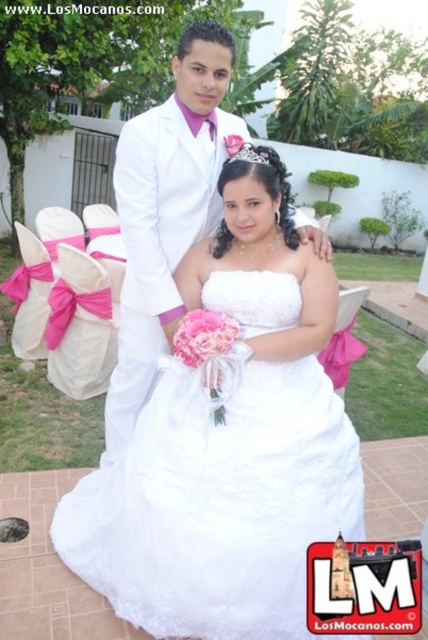
Question: Does white satin dress at center lie behind matte white suit at center?

Choices:
 (A) yes
 (B) no

Answer: (B)

Question: Which of the following is the closest to the observer?

Choices:
 (A) white satin dress at center
 (B) matte white suit at center

Answer: (A)

Question: Where is white satin dress at center located in relation to matte white suit at center in the image?

Choices:
 (A) right
 (B) left

Answer: (A)

Question: Which of the following is the farthest from the observer?

Choices:
 (A) matte white suit at center
 (B) white satin dress at center

Answer: (A)

Question: Does white satin dress at center appear under matte white suit at center?

Choices:
 (A) yes
 (B) no

Answer: (A)

Question: Which of the following is the closest to the observer?

Choices:
 (A) white satin dress at center
 (B) matte white suit at center

Answer: (A)